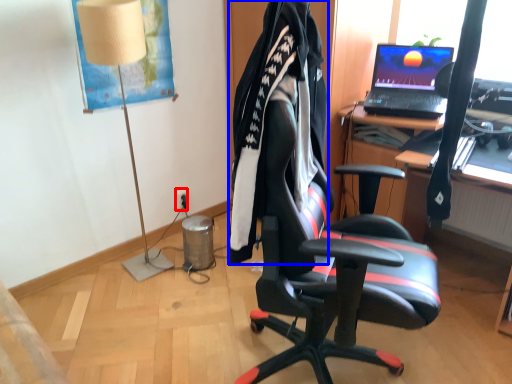
Question: Which point is closer to the camera, power outlet (highlighted by a red box) or clothing (highlighted by a blue box)?

Choices:
 (A) power outlet
 (B) clothing

Answer: (B)